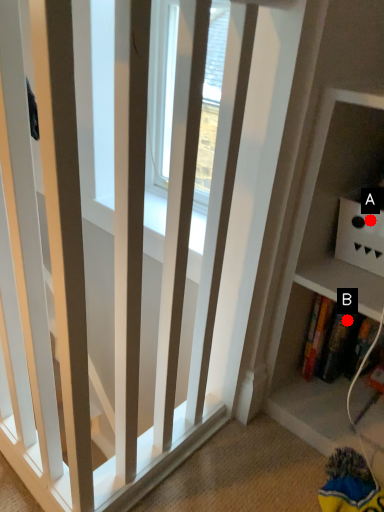
Question: Two points are circled on the image, labeled by A and B beside each circle. Which point appears closest to the camera in this image?

Choices:
 (A) A is closer
 (B) B is closer

Answer: (A)